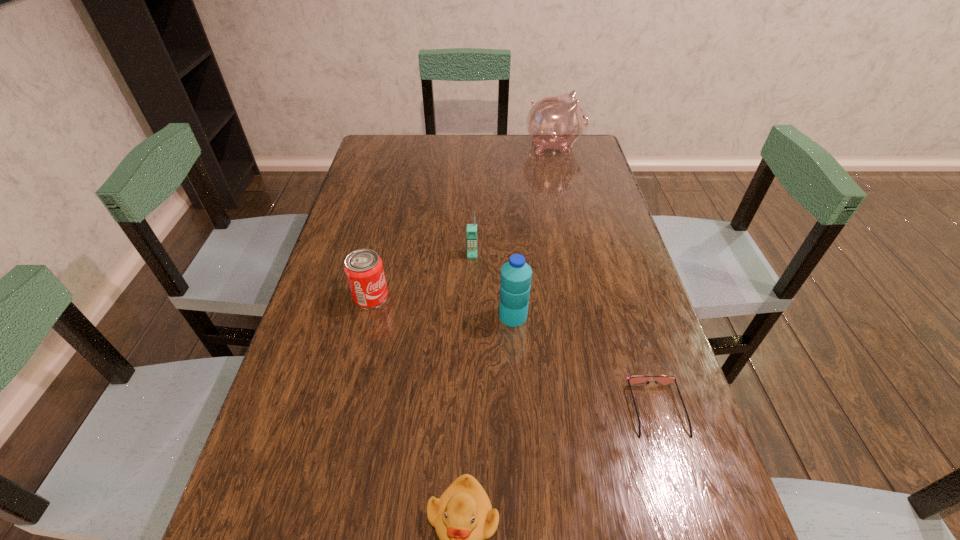
Locate an element on the screen. The width and height of the screenshot is (960, 540). the farthest object is located at coordinates (555, 122).

The image size is (960, 540). Find the location of `the fourth object from left to right`. the fourth object from left to right is located at coordinates (515, 282).

At what (x,y) coordinates should I click in order to perform the action: click on cellular telephone. Please return your answer as a coordinate pair (x, y). The height and width of the screenshot is (540, 960). Looking at the image, I should click on (471, 231).

At what (x,y) coordinates should I click in order to perform the action: click on the leftmost object. Please return your answer as a coordinate pair (x, y). The image size is (960, 540). Looking at the image, I should click on (364, 270).

Locate an element on the screen. This screenshot has height=540, width=960. the shortest object is located at coordinates (664, 380).

Identify the location of sunglasses. The image size is (960, 540). (664, 380).

At what (x,y) coordinates should I click in order to perform the action: click on vacant space located on the back of the water bottle. Please return your answer as a coordinate pair (x, y). This screenshot has height=540, width=960. Looking at the image, I should click on (506, 207).

Locate an element on the screen. free space located 0.220m on the keypad of the cellular telephone is located at coordinates [x=471, y=323].

Find the location of a particular element. vacant space situated on the front of the can is located at coordinates (354, 367).

Identify the location of vacant point located 0.110m on the bridge of the shortest object. The height and width of the screenshot is (540, 960). (684, 500).